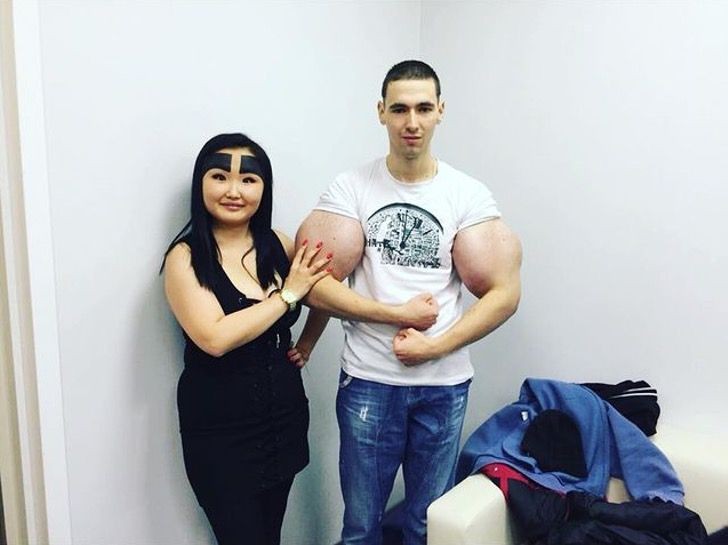
Identify the location of door frame. Image resolution: width=728 pixels, height=545 pixels. (17, 298).